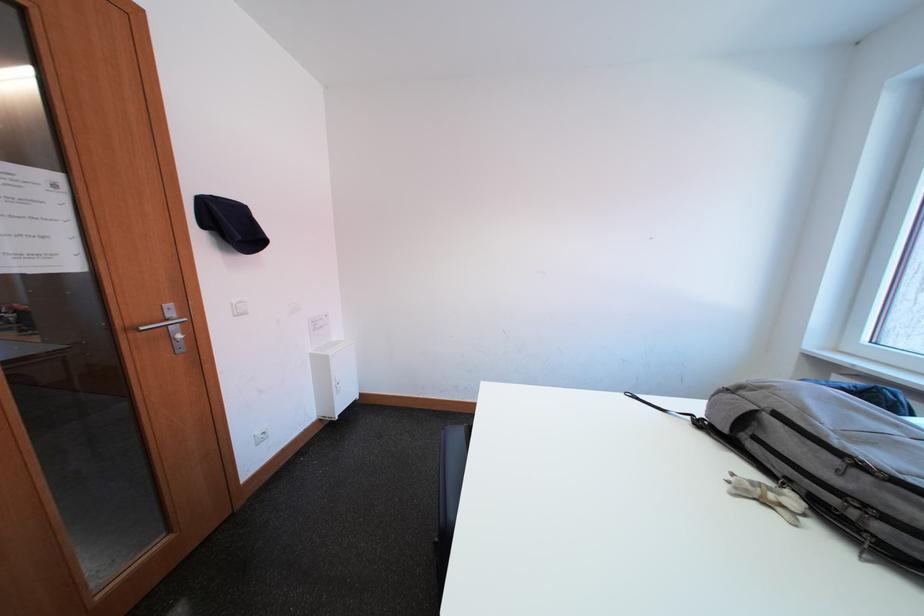
Find where to push the white light switch. Please return your answer as a coordinate pair (x, y).

(238, 307)